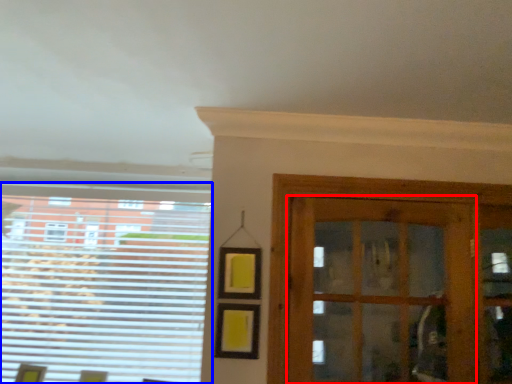
Question: Which of the following is the closest to the observer, door (highlighted by a red box) or window (highlighted by a blue box)?

Choices:
 (A) door
 (B) window

Answer: (A)